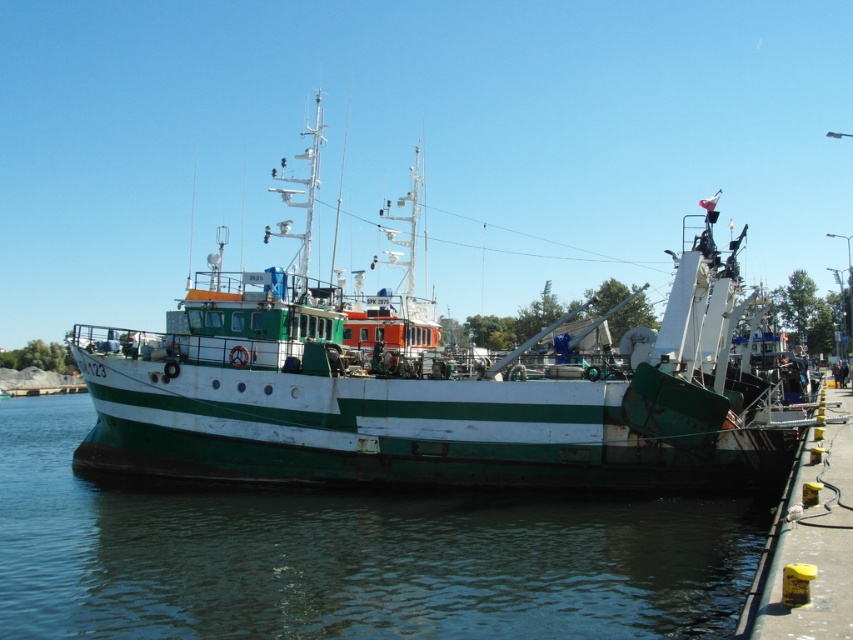
Question: Which of the following is the farthest from the observer?

Choices:
 (A) green matte boat at center
 (B) green matte water at lower center

Answer: (A)

Question: Among these points, which one is farthest from the camera?

Choices:
 (A) (426, 388)
 (B) (402, 538)

Answer: (A)

Question: Is green matte water at lower center positioned before green matte boat at center?

Choices:
 (A) no
 (B) yes

Answer: (B)

Question: Among these objects, which one is farthest from the camera?

Choices:
 (A) green matte water at lower center
 (B) green matte boat at center

Answer: (B)

Question: Does green matte water at lower center have a greater width compared to green matte boat at center?

Choices:
 (A) no
 (B) yes

Answer: (A)

Question: Can you confirm if green matte water at lower center is positioned above green matte boat at center?

Choices:
 (A) no
 (B) yes

Answer: (A)